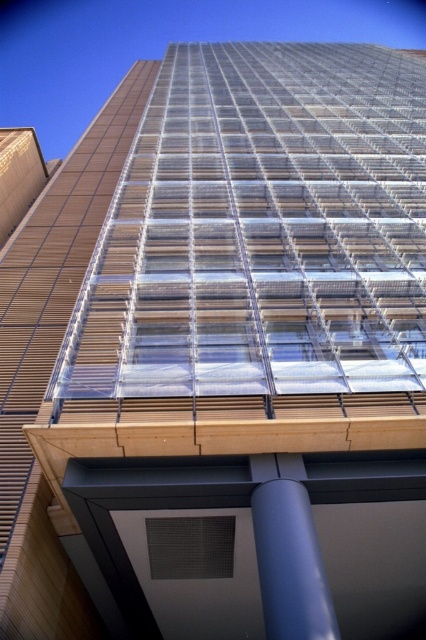
Question: Does blue matte/finish pillar at lower center appear over black mesh panel at lower center?

Choices:
 (A) yes
 (B) no

Answer: (A)

Question: Which point is farther to the camera?

Choices:
 (A) (316, 614)
 (B) (215, 528)

Answer: (B)

Question: Does blue matte/finish pillar at lower center have a smaller size compared to black mesh panel at lower center?

Choices:
 (A) yes
 (B) no

Answer: (B)

Question: Is blue matte/finish pillar at lower center closer to camera compared to black mesh panel at lower center?

Choices:
 (A) no
 (B) yes

Answer: (B)

Question: Which point appears farthest from the camera in this image?

Choices:
 (A) (233, 540)
 (B) (259, 480)

Answer: (A)